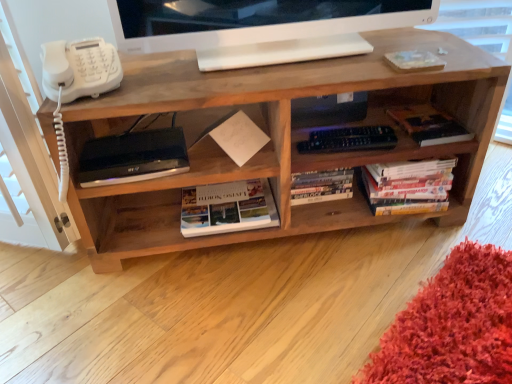
The height and width of the screenshot is (384, 512). In order to click on free spot to the right of white plastic phone at left in this screenshot , I will do `click(164, 71)`.